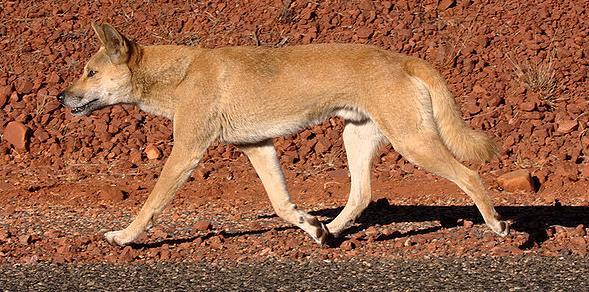
Where is `white fur`? Image resolution: width=589 pixels, height=292 pixels. white fur is located at coordinates [360, 153].